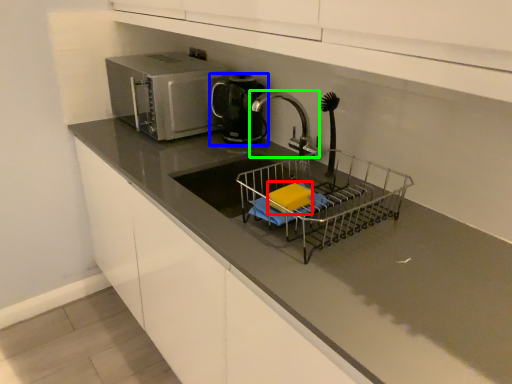
Question: Considering the real-world distances, which object is farthest from food (highlighted by a red box)? kitchen appliance (highlighted by a blue box) or tap (highlighted by a green box)?

Choices:
 (A) kitchen appliance
 (B) tap

Answer: (A)